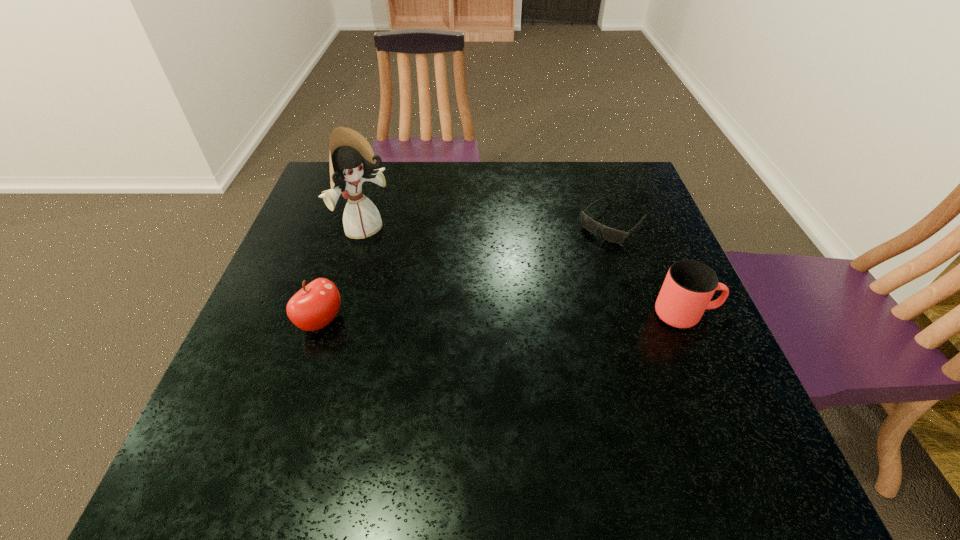
At what (x,y) coordinates should I click in order to perform the action: click on vacant space at the near left corner of the desktop. Please return your answer as a coordinate pair (x, y). Looking at the image, I should click on (225, 388).

In order to click on free space at the far right corner in this screenshot , I will do `click(621, 174)`.

The image size is (960, 540). Find the location of `vacant area at the near right corner of the desktop`. vacant area at the near right corner of the desktop is located at coordinates (722, 410).

The width and height of the screenshot is (960, 540). I want to click on free space between the apple and the tallest object, so click(343, 275).

I want to click on free space between the apple and the doll, so click(x=343, y=275).

At what (x,y) coordinates should I click in order to perform the action: click on free spot between the tallest object and the apple. Please return your answer as a coordinate pair (x, y). Looking at the image, I should click on (343, 275).

Image resolution: width=960 pixels, height=540 pixels. Find the location of `unoccupied area between the apple and the cup`. unoccupied area between the apple and the cup is located at coordinates (503, 318).

Locate an element on the screen. The width and height of the screenshot is (960, 540). vacant region between the apple and the sunglasses is located at coordinates (467, 272).

Find the location of `vacant area that lies between the apple and the sunglasses`. vacant area that lies between the apple and the sunglasses is located at coordinates (467, 272).

At what (x,y) coordinates should I click in order to perform the action: click on vacant area that lies between the shortest object and the doll. Please return your answer as a coordinate pair (x, y). The image size is (960, 540). Looking at the image, I should click on (489, 227).